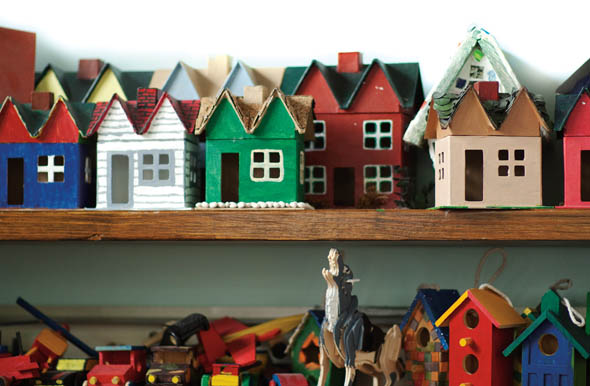
Where is `door`? Image resolution: width=590 pixels, height=386 pixels. door is located at coordinates (475, 176), (344, 185), (235, 183), (122, 183), (17, 180).